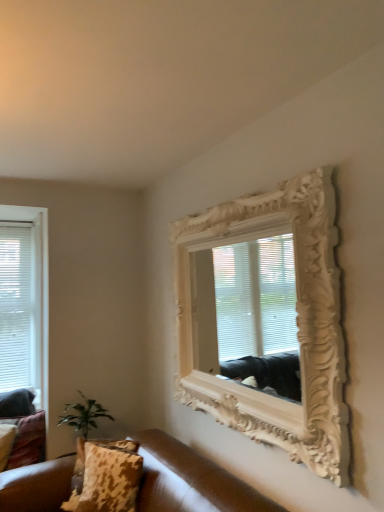
Question: Is green leafy plant at lower left placed right next to leopard print fabric pillow at lower left, positioned as the 1th pillow in right-to-left order?

Choices:
 (A) no
 (B) yes

Answer: (A)

Question: Is green leafy plant at lower left looking in the opposite direction of leopard print fabric pillow at lower left, which is the 1th pillow from front to back?

Choices:
 (A) no
 (B) yes

Answer: (A)

Question: Would you say green leafy plant at lower left contains leopard print fabric pillow at lower left, positioned as the 1th pillow in right-to-left order?

Choices:
 (A) yes
 (B) no

Answer: (B)

Question: Is green leafy plant at lower left bigger than leopard print fabric pillow at lower left, the third pillow from the left?

Choices:
 (A) yes
 (B) no

Answer: (A)

Question: Is green leafy plant at lower left in front of leopard print fabric pillow at lower left, the third pillow from the left?

Choices:
 (A) no
 (B) yes

Answer: (A)

Question: From a real-world perspective, is green leafy plant at lower left located beneath leopard print fabric pillow at lower left, positioned as the 1th pillow in right-to-left order?

Choices:
 (A) no
 (B) yes

Answer: (A)

Question: Is green leafy plant at lower left completely or partially outside of leopard print fabric pillow at lower left, the second pillow positioned from the back?

Choices:
 (A) yes
 (B) no

Answer: (A)

Question: Does green leafy plant at lower left have a smaller size compared to leopard print fabric pillow at lower left, arranged as the third pillow when viewed from the right?

Choices:
 (A) yes
 (B) no

Answer: (B)

Question: From the image's perspective, is green leafy plant at lower left located beneath leopard print fabric pillow at lower left, placed as the second pillow when sorted from front to back?

Choices:
 (A) no
 (B) yes

Answer: (A)

Question: Considering the relative sizes of green leafy plant at lower left and leopard print fabric pillow at lower left, the second pillow positioned from the back, in the image provided, is green leafy plant at lower left wider than leopard print fabric pillow at lower left, the second pillow positioned from the back,?

Choices:
 (A) yes
 (B) no

Answer: (A)

Question: Considering the relative sizes of green leafy plant at lower left and leopard print fabric pillow at lower left, placed as the second pillow when sorted from front to back, in the image provided, is green leafy plant at lower left shorter than leopard print fabric pillow at lower left, placed as the second pillow when sorted from front to back,?

Choices:
 (A) no
 (B) yes

Answer: (A)

Question: Is green leafy plant at lower left further to camera compared to leopard print fabric pillow at lower left, arranged as the third pillow when viewed from the right?

Choices:
 (A) no
 (B) yes

Answer: (A)

Question: Is green leafy plant at lower left directly adjacent to leopard print fabric pillow at lower left, the first pillow viewed from the back?

Choices:
 (A) yes
 (B) no

Answer: (B)